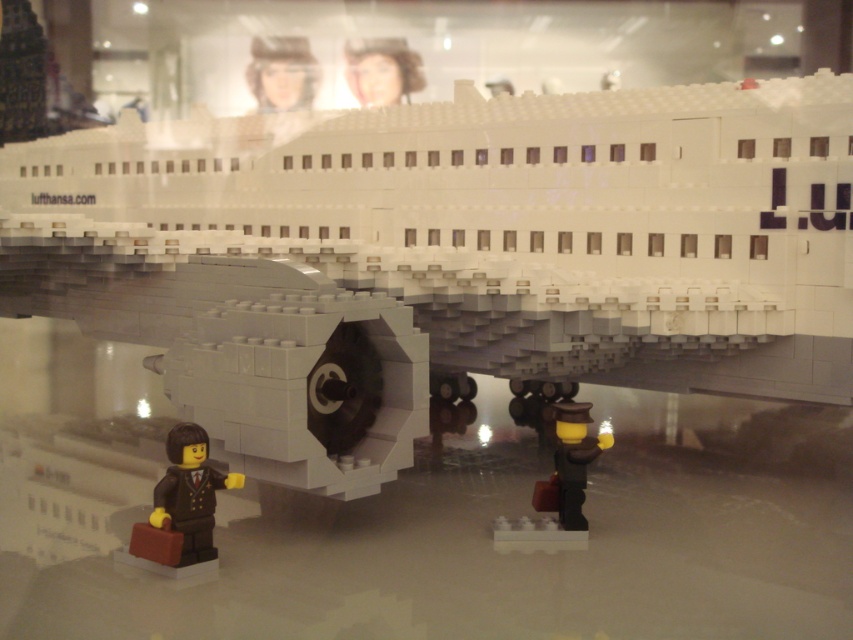
Question: Does matte plastic head at upper center have a smaller size compared to matte white airplane at center?

Choices:
 (A) yes
 (B) no

Answer: (A)

Question: Does brown matte briefcase at lower left have a larger size compared to matte white airplane at center?

Choices:
 (A) no
 (B) yes

Answer: (A)

Question: In this image, where is matte plastic head at upper center located relative to matte white airplane at center?

Choices:
 (A) left
 (B) right

Answer: (A)

Question: Which point is farther from the camera taking this photo?

Choices:
 (A) (190, 456)
 (B) (369, 88)
 (C) (265, 97)

Answer: (C)

Question: Among these points, which one is nearest to the camera?

Choices:
 (A) (383, 90)
 (B) (271, 104)
 (C) (173, 470)

Answer: (C)

Question: Which of these objects is positioned farthest from the brown matte briefcase at lower left?

Choices:
 (A) matte plastic head at upper center
 (B) matte white airplane at center

Answer: (A)